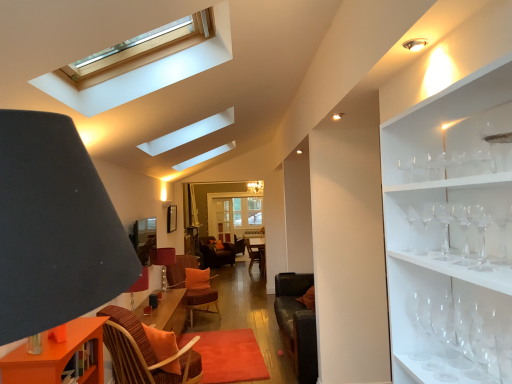
Question: Does transparent glass wine glass at right, which ranks as the 2th wine glass in back-to-front order, have a greater height compared to clear glass wine glass at right, placed as the sixth wine glass when sorted from front to back?

Choices:
 (A) yes
 (B) no

Answer: (A)

Question: Is transparent glass wine glass at right, which is the seventh wine glass in front-to-back order, closer to the viewer compared to clear glass wine glass at right, placed as the sixth wine glass when sorted from front to back?

Choices:
 (A) yes
 (B) no

Answer: (B)

Question: Does transparent glass wine glass at right, which is the seventh wine glass in front-to-back order, appear on the right side of clear glass wine glass at right, positioned as the third wine glass in back-to-front order?

Choices:
 (A) yes
 (B) no

Answer: (A)

Question: Does transparent glass wine glass at right, which ranks as the 2th wine glass in back-to-front order, lie behind clear glass wine glass at right, placed as the sixth wine glass when sorted from front to back?

Choices:
 (A) yes
 (B) no

Answer: (A)

Question: Is transparent glass wine glass at right, which ranks as the 2th wine glass in back-to-front order, wider than clear glass wine glass at right, placed as the sixth wine glass when sorted from front to back?

Choices:
 (A) no
 (B) yes

Answer: (B)

Question: Is transparent glass wine glass at right, which is the seventh wine glass in front-to-back order, completely or partially outside of clear glass wine glass at right, positioned as the third wine glass in back-to-front order?

Choices:
 (A) yes
 (B) no

Answer: (A)

Question: Considering the relative sizes of clear glass wine glass at right, which appears as the fifth wine glass when viewed from the back, and clear glass wine glass at right, which ranks as the seventh wine glass in back-to-front order, in the image provided, is clear glass wine glass at right, which appears as the fifth wine glass when viewed from the back, thinner than clear glass wine glass at right, which ranks as the seventh wine glass in back-to-front order,?

Choices:
 (A) no
 (B) yes

Answer: (A)

Question: Can you confirm if clear glass wine glass at right, arranged as the fourth wine glass when viewed from the front, is wider than clear glass wine glass at right, the 2th wine glass when ordered from front to back?

Choices:
 (A) yes
 (B) no

Answer: (A)

Question: Is clear glass wine glass at right, arranged as the fourth wine glass when viewed from the front, behind clear glass wine glass at right, the 2th wine glass when ordered from front to back?

Choices:
 (A) yes
 (B) no

Answer: (A)

Question: Is clear glass wine glass at right, arranged as the fourth wine glass when viewed from the front, smaller than clear glass wine glass at right, which ranks as the seventh wine glass in back-to-front order?

Choices:
 (A) yes
 (B) no

Answer: (B)

Question: Considering the relative positions of clear glass wine glass at right, arranged as the fourth wine glass when viewed from the front, and clear glass wine glass at right, which ranks as the seventh wine glass in back-to-front order, in the image provided, is clear glass wine glass at right, arranged as the fourth wine glass when viewed from the front, to the right of clear glass wine glass at right, which ranks as the seventh wine glass in back-to-front order, from the viewer's perspective?

Choices:
 (A) yes
 (B) no

Answer: (B)

Question: Considering the relative sizes of clear glass wine glass at right, which appears as the fifth wine glass when viewed from the back, and clear glass wine glass at right, the 2th wine glass when ordered from front to back, in the image provided, is clear glass wine glass at right, which appears as the fifth wine glass when viewed from the back, taller than clear glass wine glass at right, the 2th wine glass when ordered from front to back,?

Choices:
 (A) no
 (B) yes

Answer: (B)

Question: Is clear glass wine glass at right, placed as the sixth wine glass when sorted from front to back, positioned in front of transparent glass wine glass at right, placed as the first wine glass when sorted from back to front?

Choices:
 (A) no
 (B) yes

Answer: (B)